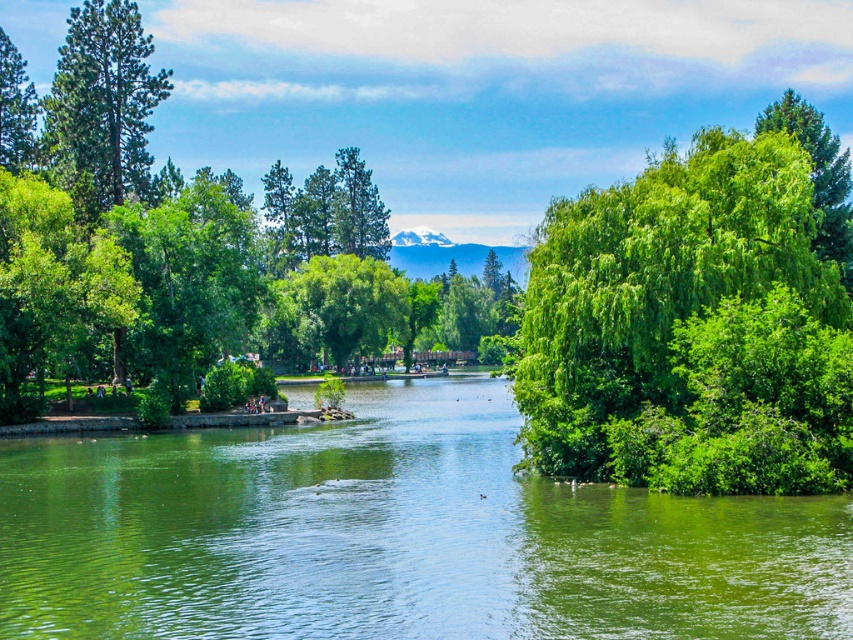
You are standing at the point closer to the camera in the image. Which point are you at, point (706, 317) or point (840, 202)?

You are at point (706, 317) because it is closer to the camera than point (840, 202).

You are standing at the water edge and want to take a photo of both the green textured tree at upper left and the green leafy tree at center. Which tree should you move closer to in order to include both in your frame without zooming?

You should move closer to the green leafy tree at center because the green textured tree at upper left is in front of it, so moving closer to the background tree would help include both in the frame.